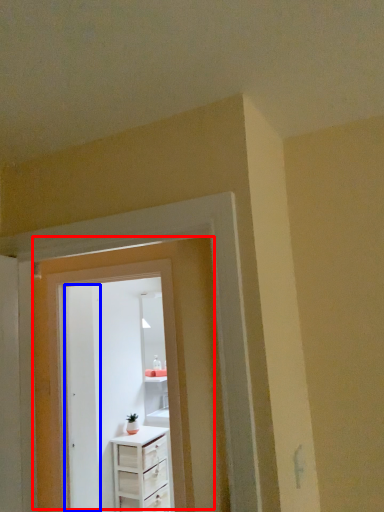
Question: Which object appears closest to the camera in this image, door (highlighted by a red box) or door (highlighted by a blue box)?

Choices:
 (A) door
 (B) door

Answer: (A)